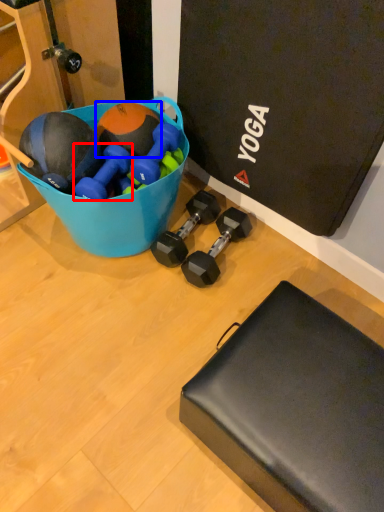
Question: Among these objects, which one is nearest to the camera, dumbbell (highlighted by a red box) or sports equipment (highlighted by a blue box)?

Choices:
 (A) dumbbell
 (B) sports equipment

Answer: (A)